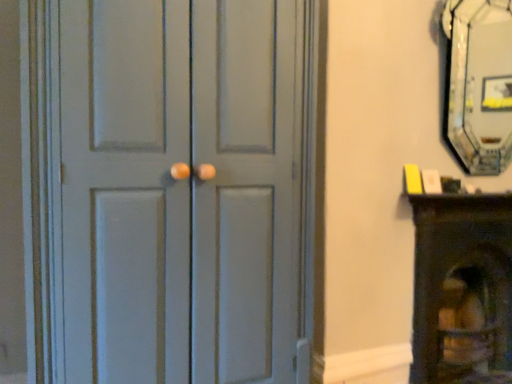
Question: Looking at the image, does wooden fireplace at right seem bigger or smaller compared to black glass fireplace at upper right?

Choices:
 (A) small
 (B) big

Answer: (B)

Question: Choose the correct answer: Is wooden fireplace at right inside black glass fireplace at upper right or outside it?

Choices:
 (A) outside
 (B) inside

Answer: (A)

Question: Estimate the real-world distances between objects in this image. Which object is closer to the matte gray door at center?

Choices:
 (A) black glass fireplace at upper right
 (B) wooden fireplace at right

Answer: (B)

Question: Which is farther from the wooden fireplace at right?

Choices:
 (A) matte gray door at center
 (B) black glass fireplace at upper right

Answer: (B)